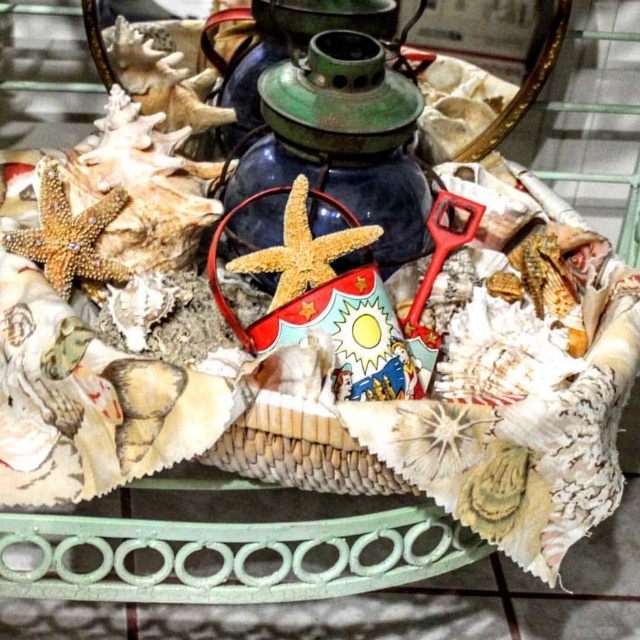
Consider the image. You are standing in front of the table with the decorative arrangement. There are two points marked on the table surface. Which point is closer to you, point (x=308, y=259) or point (x=317, y=99)?

Point (x=308, y=259) is closer to the viewer than point (x=317, y=99).

You are standing at the edge of the table and want to place a new decorative item exactly where the matte wicker basket at center is currently located. According to the coordinates provided, what are the coordinates where you should place the new item?

The coordinates for the matte wicker basket at center are at point (323, 300), so you should place the new item at those coordinates.

You are at the center of the table and see the point marked at coordinates (x=323, y=300). What object is located at that point?

The point at coordinates (x=323, y=300) indicates a matte wicker basket at center.